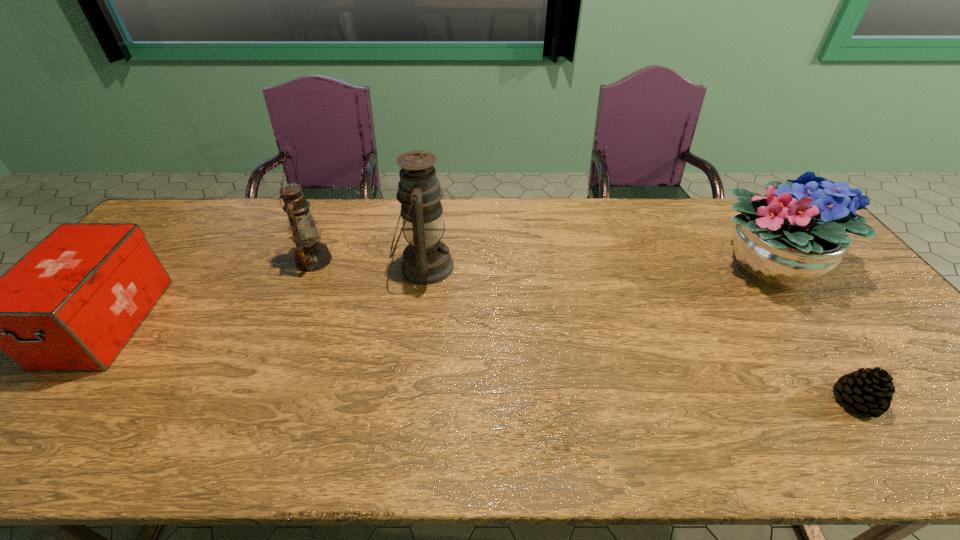
Find the location of `the fourth object from right to left`. the fourth object from right to left is located at coordinates (311, 255).

Identify the location of the right oil lamp. The image size is (960, 540). (426, 260).

Image resolution: width=960 pixels, height=540 pixels. In order to click on bouquet in this screenshot , I will do `click(798, 232)`.

At what (x,y) coordinates should I click in order to perform the action: click on the leftmost object. Please return your answer as a coordinate pair (x, y). Image resolution: width=960 pixels, height=540 pixels. Looking at the image, I should click on (72, 303).

Where is `the first-aid kit`? The image size is (960, 540). the first-aid kit is located at coordinates coord(72,303).

The image size is (960, 540). I want to click on the shortest object, so click(870, 391).

The width and height of the screenshot is (960, 540). I want to click on pinecone, so click(870, 391).

Where is `blank area located 0.230m on the right of the second object from left to right`? blank area located 0.230m on the right of the second object from left to right is located at coordinates (406, 260).

Locate an element on the screen. vacant area located 0.050m on the right of the right oil lamp is located at coordinates (470, 267).

Identify the location of blank space located 0.180m on the left of the bouquet. (647, 267).